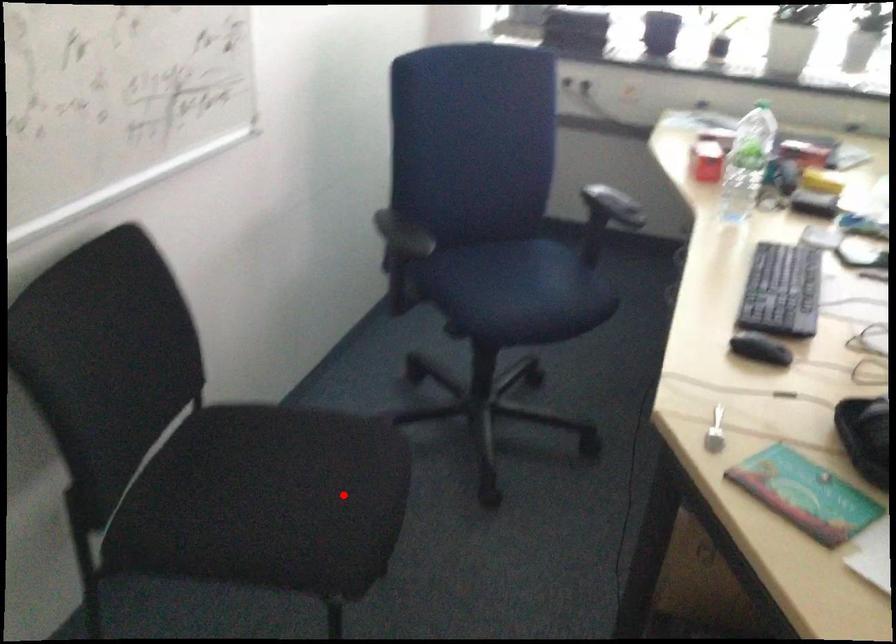
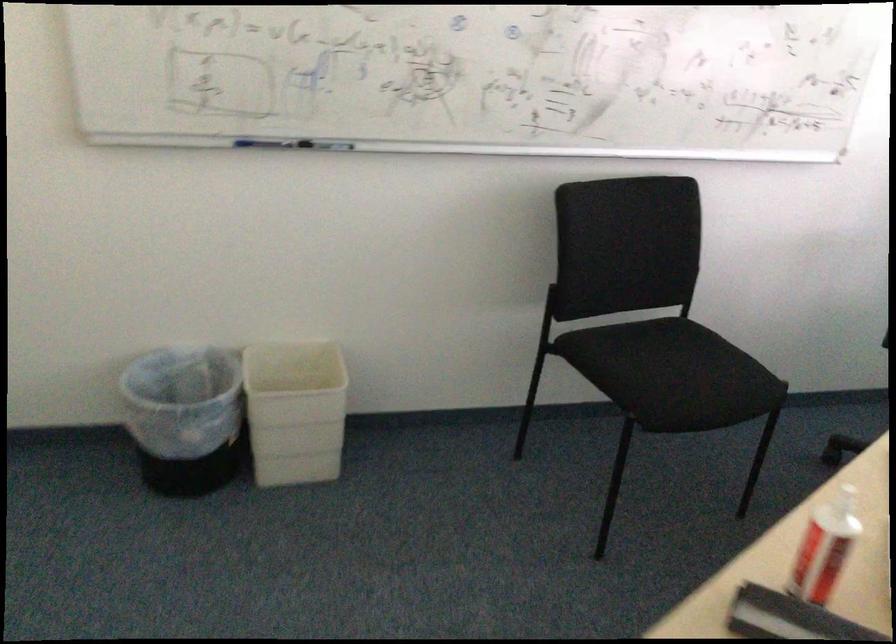
In the second image, find the point that corresponds to the highlighted location in the first image.

(688, 379)